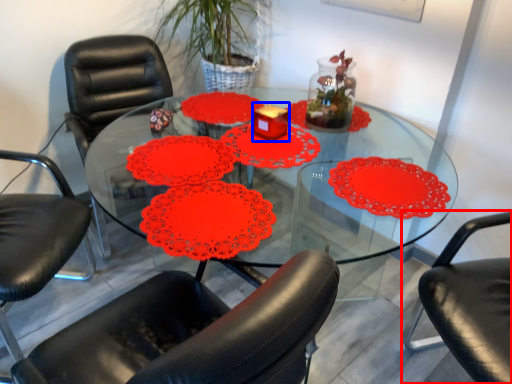
Question: Which object appears closest to the camera in this image, chair (highlighted by a red box) or candle holder (highlighted by a blue box)?

Choices:
 (A) chair
 (B) candle holder

Answer: (A)